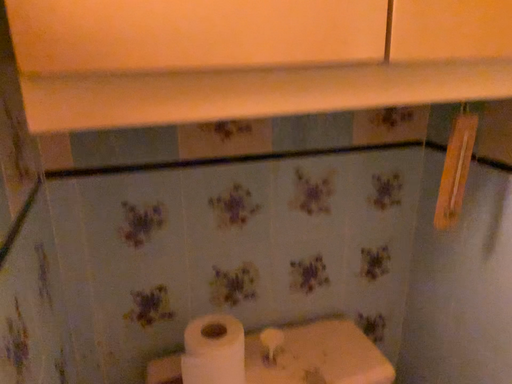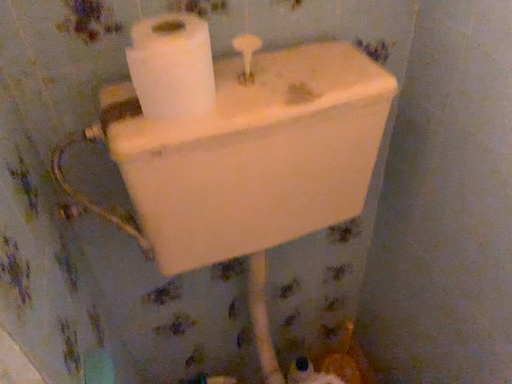
Question: Which way did the camera rotate in the video?

Choices:
 (A) rotated upward
 (B) rotated downward

Answer: (B)